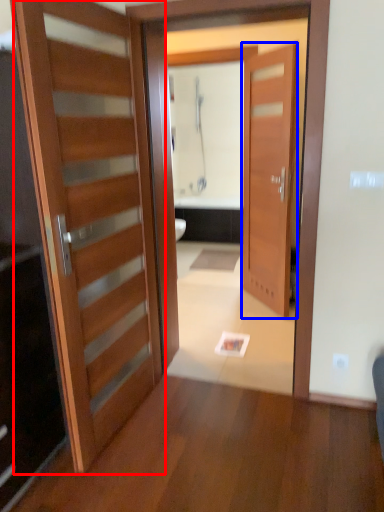
Question: Among these objects, which one is nearest to the camera, door (highlighted by a red box) or door (highlighted by a blue box)?

Choices:
 (A) door
 (B) door

Answer: (A)